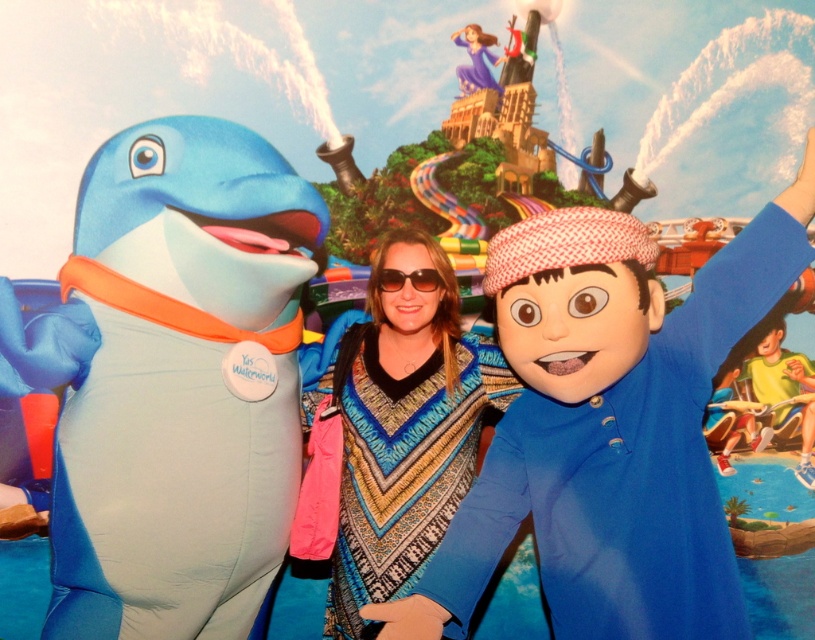
Question: Does patterned poncho at center have a lesser width compared to purple satin dress at upper center?

Choices:
 (A) yes
 (B) no

Answer: (B)

Question: Which of the following is the farthest from the observer?

Choices:
 (A) sunglasses at center
 (B) patterned poncho at center
 (C) purple satin dress at upper center
 (D) blue fabric character at right

Answer: (C)

Question: Is blue fabric character at right to the right of sunglasses at center from the viewer's perspective?

Choices:
 (A) no
 (B) yes

Answer: (B)

Question: Which is nearer to the patterned poncho at center?

Choices:
 (A) sunglasses at center
 (B) purple satin dress at upper center

Answer: (A)

Question: In this image, where is blue fabric character at right located relative to purple satin dress at upper center?

Choices:
 (A) left
 (B) right

Answer: (B)

Question: Which object is farther from the camera taking this photo?

Choices:
 (A) purple satin dress at upper center
 (B) sunglasses at center

Answer: (A)